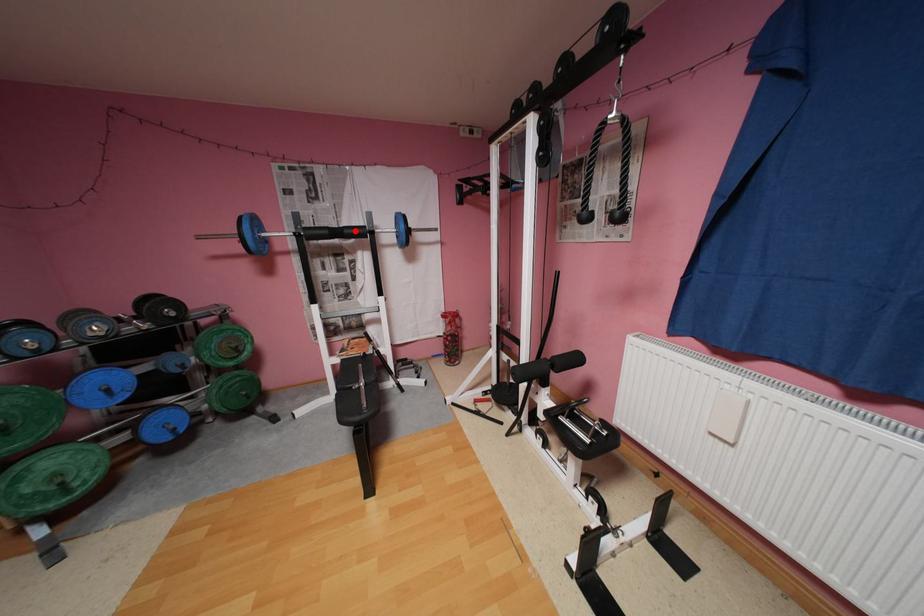
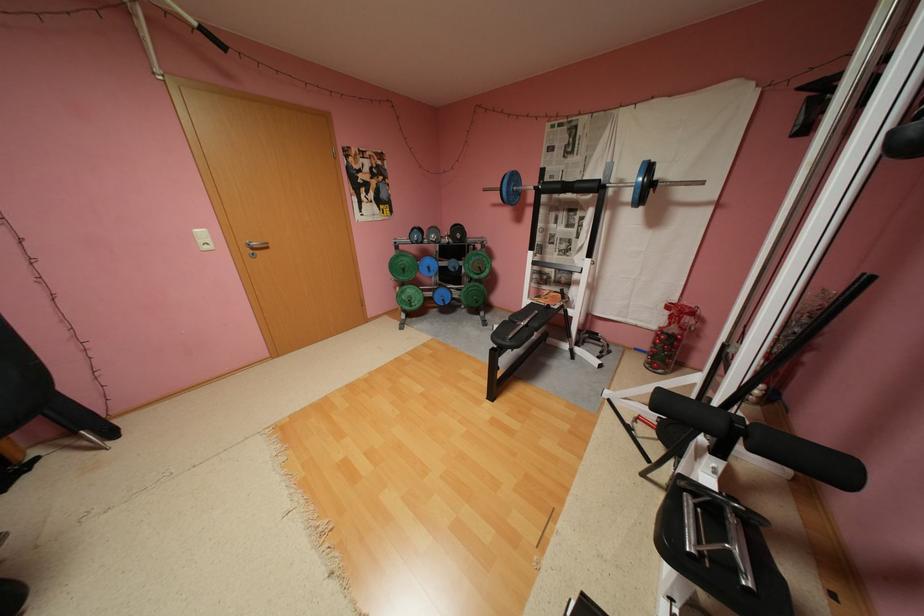
The point at the highlighted location is marked in the first image. Where is the corresponding point in the second image?

(586, 185)